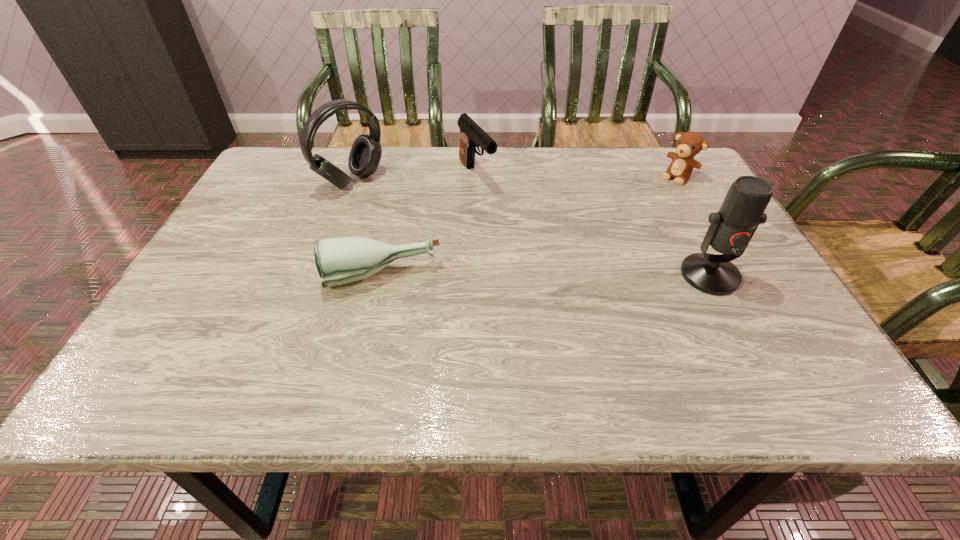
Image resolution: width=960 pixels, height=540 pixels. I want to click on free space on the desktop that is between the shortest object and the microphone and is positioned at the barrel of the third tallest object, so click(565, 276).

Identify the location of free space on the desktop that is between the shortest object and the microphone and is positioned on the face of the teddy bear. The width and height of the screenshot is (960, 540). (560, 276).

Where is `free space on the desktop that is between the shortest object and the microphone and is positioned on the earcups of the headset`? The width and height of the screenshot is (960, 540). free space on the desktop that is between the shortest object and the microphone and is positioned on the earcups of the headset is located at coordinates (499, 276).